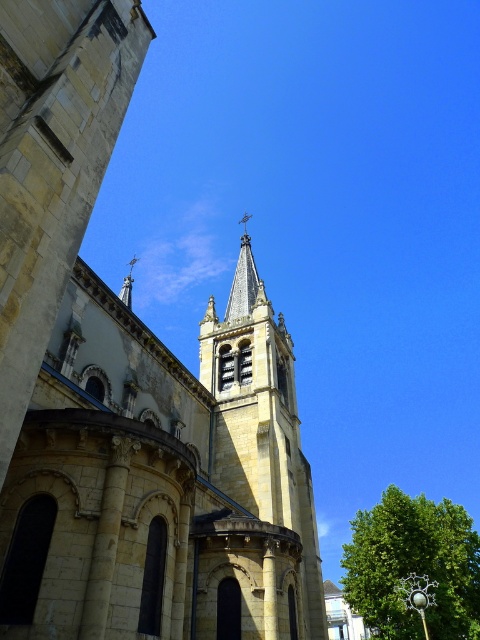
Question: Can you confirm if yellow stone church steeple at center is positioned above smooth gray stone spire at upper center?

Choices:
 (A) yes
 (B) no

Answer: (B)

Question: Does yellow stone tower at center have a lesser width compared to green leafy tree at lower right?

Choices:
 (A) yes
 (B) no

Answer: (A)

Question: Which point appears closest to the camera in this image?

Choices:
 (A) (420, 563)
 (B) (252, 600)

Answer: (B)

Question: Which object is positioned farthest from the green leafy tree at lower right?

Choices:
 (A) yellow stone tower at center
 (B) smooth gray stone spire at upper center

Answer: (B)

Question: Based on their relative distances, which object is nearer to the green leafy tree at lower right?

Choices:
 (A) smooth gray stone spire at upper center
 (B) yellow stone church steeple at center
 (C) yellow stone tower at center

Answer: (C)

Question: Is the position of yellow stone church steeple at center less distant than that of green leafy tree at lower right?

Choices:
 (A) no
 (B) yes

Answer: (B)